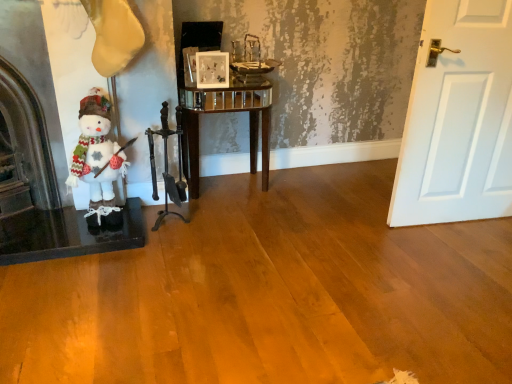
Locate an element on the screen. This screenshot has height=384, width=512. free point in front of dark brown polished wood fireplace tools at center is located at coordinates (164, 252).